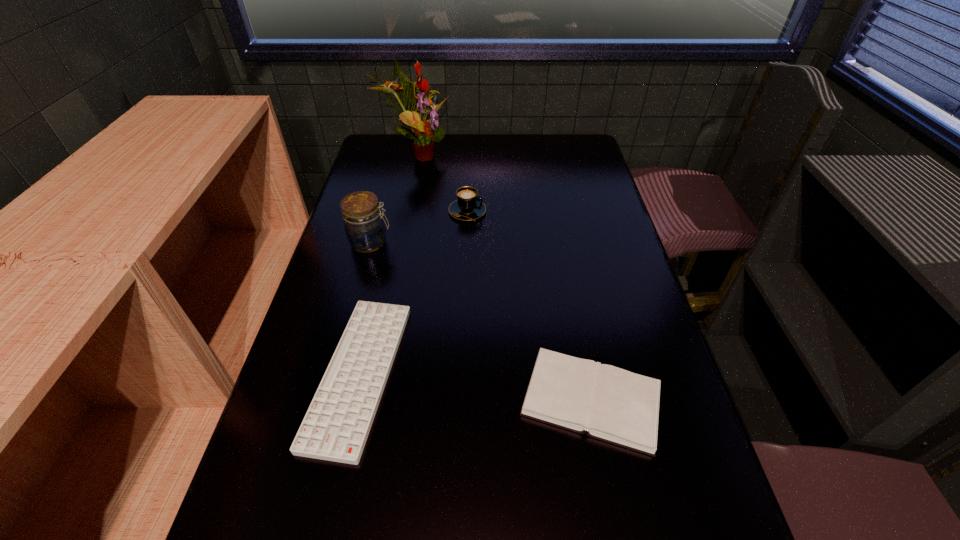
You are a GUI agent. You are given a task and a screenshot of the screen. Output one action in this format:
    pyautogui.click(x=<x>, y=<y>)
    Task: Click on the vacant region located 0.280m on the right of the third tallest object
    The image size is (960, 540).
    Given the screenshot: What is the action you would take?
    pyautogui.click(x=577, y=212)

Where is `vacant space situated 0.370m on the left of the rightmost object`? Image resolution: width=960 pixels, height=540 pixels. vacant space situated 0.370m on the left of the rightmost object is located at coordinates (339, 400).

Where is `vacant space located 0.310m on the right of the computer keyboard`? vacant space located 0.310m on the right of the computer keyboard is located at coordinates (545, 374).

The image size is (960, 540). Find the location of `object situated at the far edge`. object situated at the far edge is located at coordinates (425, 132).

Where is `bouquet located at the left edge`? bouquet located at the left edge is located at coordinates (425, 132).

Identify the location of jar present at the left edge. (364, 226).

The image size is (960, 540). Find the location of `computer keyboard that is at the left edge`. computer keyboard that is at the left edge is located at coordinates (336, 426).

The height and width of the screenshot is (540, 960). What are the coordinates of `object at the right edge` in the screenshot? It's located at (614, 405).

The height and width of the screenshot is (540, 960). I want to click on object present at the far left corner, so click(425, 132).

The image size is (960, 540). In the image, there is a desktop. Find the location of `vacant space at the far edge`. vacant space at the far edge is located at coordinates (412, 166).